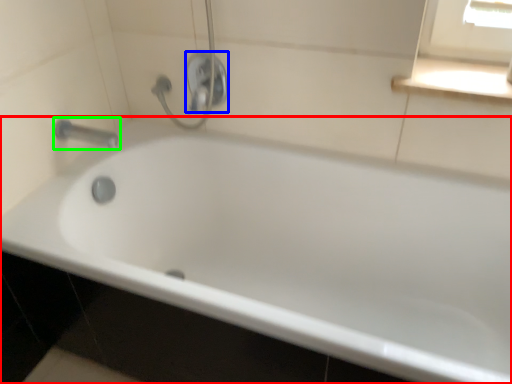
Question: Which is farther away from bathtub (highlighted by a red box)? shower (highlighted by a blue box) or tap (highlighted by a green box)?

Choices:
 (A) shower
 (B) tap

Answer: (B)